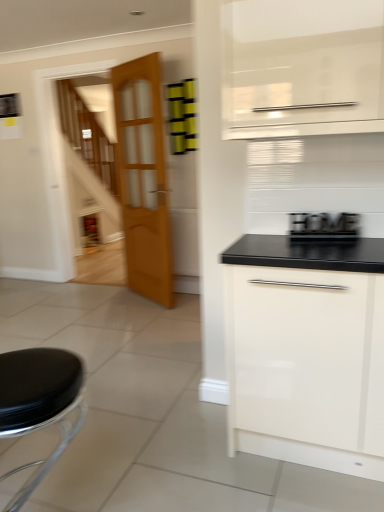
Image resolution: width=384 pixels, height=512 pixels. Describe the element at coordinates (306, 352) in the screenshot. I see `white glossy cabinet at lower right` at that location.

Locate an element on the screen. Image resolution: width=384 pixels, height=512 pixels. wooden glass door at center is located at coordinates pos(143,178).

You are a GUI agent. You are given a task and a screenshot of the screen. Output one action in this format:
    pyautogui.click(x=<x>, y=<y>)
    Task: Click on the black leather stool at lower left
    
    Given the screenshot: What is the action you would take?
    pyautogui.click(x=39, y=403)

The height and width of the screenshot is (512, 384). Find the location of `black wood sign at right`. black wood sign at right is located at coordinates (323, 228).

Which object is more forward, black wood sign at right or white glossy cabinet at lower right?

white glossy cabinet at lower right.

Considering the sizes of objects black wood sign at right and white glossy cabinet at lower right in the image provided, who is thinner, black wood sign at right or white glossy cabinet at lower right?

black wood sign at right.

Which of these two, black wood sign at right or white glossy cabinet at lower right, is smaller?

black wood sign at right.

Where is `cabinetry lying on the left of black wood sign at right`? cabinetry lying on the left of black wood sign at right is located at coordinates (306, 352).

From the image's perspective, is black wood sign at right on top of black leather stool at lower left?

Yes, from the image's perspective, black wood sign at right is on top of black leather stool at lower left.

Looking at the image, does black wood sign at right seem bigger or smaller compared to black leather stool at lower left?

Considering their sizes, black wood sign at right takes up less space than black leather stool at lower left.

Would you consider black wood sign at right to be distant from black leather stool at lower left?

black wood sign at right is positioned a significant distance from black leather stool at lower left.

Locate an element on the screen. The width and height of the screenshot is (384, 512). appliance lying on the right of black leather stool at lower left is located at coordinates click(323, 228).

Between white glossy cabinet at lower right and black leather stool at lower left, which one has more height?

white glossy cabinet at lower right.

Would you say white glossy cabinet at lower right is outside black leather stool at lower left?

Yes, white glossy cabinet at lower right is not within black leather stool at lower left.

Does white glossy cabinet at lower right have a greater width compared to black leather stool at lower left?

Yes.

I want to click on cabinetry above the black leather stool at lower left (from the image's perspective), so click(306, 352).

This screenshot has height=512, width=384. I want to click on cabinetry lying below the wooden glass door at center (from the image's perspective), so coord(306,352).

Is point (243, 253) farther from camera compared to point (135, 167)?

No.

Can you confirm if white glossy cabinet at lower right is bigger than wooden glass door at center?

Yes, white glossy cabinet at lower right is bigger than wooden glass door at center.

From the picture: Does white glossy cabinet at lower right have a lesser width compared to wooden glass door at center?

No.

Considering the positions of point (51, 462) and point (305, 391), is point (51, 462) closer or farther from the camera than point (305, 391)?

Point (51, 462) is positioned farther from the camera compared to point (305, 391).

Between black leather stool at lower left and white glossy cabinet at lower right, which one has larger size?

white glossy cabinet at lower right.

Locate an element on the screen. The image size is (384, 512). cabinetry above the black leather stool at lower left (from the image's perspective) is located at coordinates pyautogui.click(x=306, y=352).

Is wooden glass door at center thinner than black wood sign at right?

No, wooden glass door at center is not thinner than black wood sign at right.

Based on the photo, is wooden glass door at center closer to the viewer compared to black wood sign at right?

No, it is behind black wood sign at right.

Is wooden glass door at center shorter than black wood sign at right?

In fact, wooden glass door at center may be taller than black wood sign at right.

Is wooden glass door at center placed right next to black wood sign at right?

No, wooden glass door at center is not in contact with black wood sign at right.

Which is in front, black leather stool at lower left or wooden glass door at center?

black leather stool at lower left is in front.

Is point (85, 407) in front of point (138, 177)?

Yes.

How different are the orientations of black leather stool at lower left and wooden glass door at center in degrees?

61.1 degrees separate the facing orientations of black leather stool at lower left and wooden glass door at center.

Is black leather stool at lower left aimed at wooden glass door at center?

No, black leather stool at lower left is not oriented towards wooden glass door at center.

At what (x,y) coordinates should I click in order to perform the action: click on cabinetry located in front of the black wood sign at right. Please return your answer as a coordinate pair (x, y). Looking at the image, I should click on click(x=306, y=352).

Where is `furniture on the left of black wood sign at right`? The image size is (384, 512). furniture on the left of black wood sign at right is located at coordinates (39, 403).

Looking at the image, which one is located further to white glossy cabinet at lower right, wooden glass door at center or black leather stool at lower left?

wooden glass door at center is further to white glossy cabinet at lower right.

Looking at the image, which one is located further to black leather stool at lower left, white glossy cabinet at lower right or black wood sign at right?

black wood sign at right lies further to black leather stool at lower left than the other object.

Which object lies further to the anchor point white glossy cabinet at lower right, black leather stool at lower left or black wood sign at right?

black leather stool at lower left is further to white glossy cabinet at lower right.

Which object lies nearer to the anchor point wooden glass door at center, white glossy cabinet at lower right or black wood sign at right?

black wood sign at right is positioned closer to the anchor wooden glass door at center.

Estimate the real-world distances between objects in this image. Which object is closer to black leather stool at lower left, wooden glass door at center or black wood sign at right?

Among the two, black wood sign at right is located nearer to black leather stool at lower left.

Which object lies nearer to the anchor point black leather stool at lower left, wooden glass door at center or white glossy cabinet at lower right?

Based on the image, white glossy cabinet at lower right appears to be nearer to black leather stool at lower left.

Which object lies nearer to the anchor point white glossy cabinet at lower right, black wood sign at right or wooden glass door at center?

black wood sign at right is closer to white glossy cabinet at lower right.

Considering their positions, is black wood sign at right positioned closer to black leather stool at lower left than wooden glass door at center?

black wood sign at right is positioned closer to the anchor black leather stool at lower left.

The width and height of the screenshot is (384, 512). What are the coordinates of `appliance between black leather stool at lower left and wooden glass door at center along the z-axis` in the screenshot? It's located at (323, 228).

Locate an element on the screen. appliance positioned between white glossy cabinet at lower right and wooden glass door at center from near to far is located at coordinates point(323,228).

Locate an element on the screen. This screenshot has height=512, width=384. cabinetry situated between black leather stool at lower left and black wood sign at right from left to right is located at coordinates (306, 352).

Identify the location of cabinetry between black leather stool at lower left and wooden glass door at center in the front-back direction. The height and width of the screenshot is (512, 384). (306, 352).